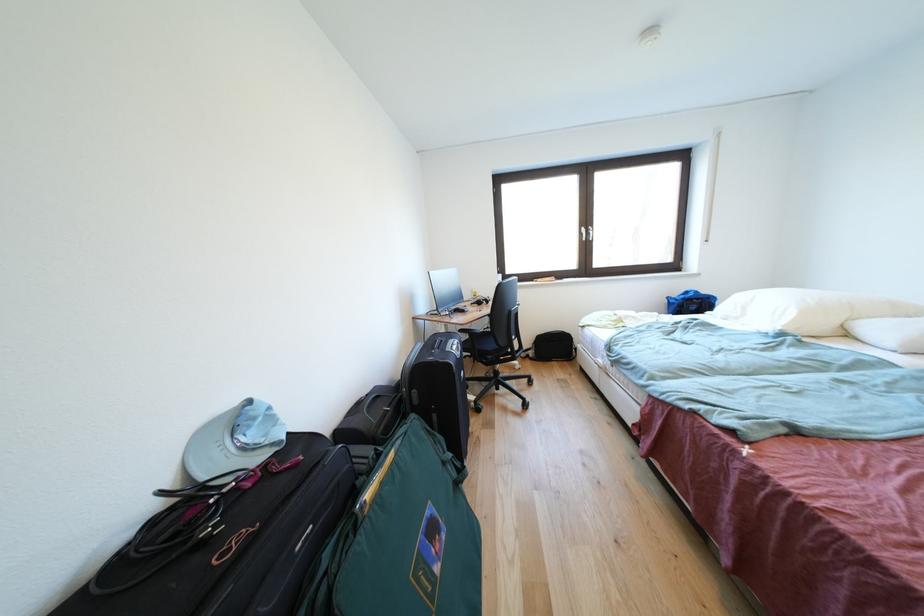
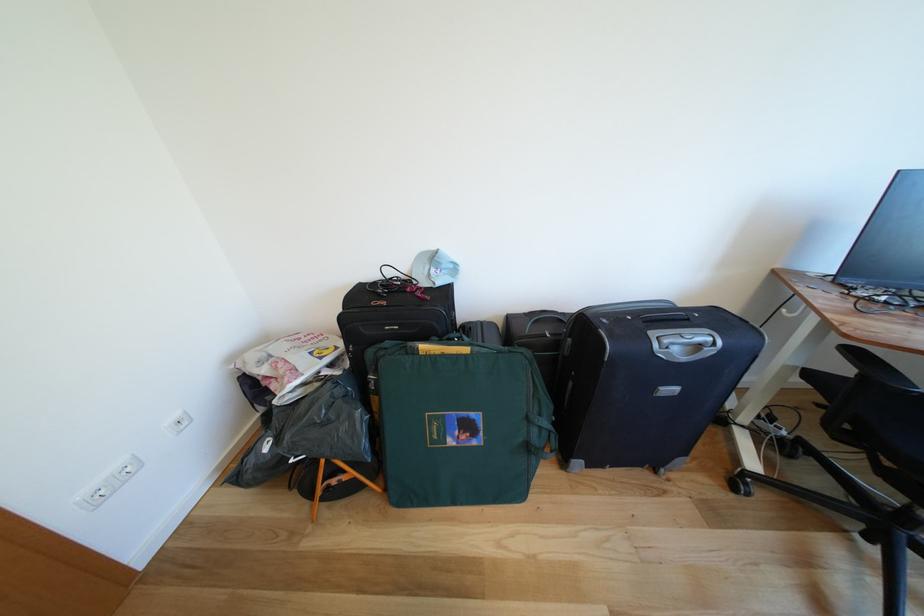
Find the pixel in the second image that matches [249,421] in the first image.

(442, 262)